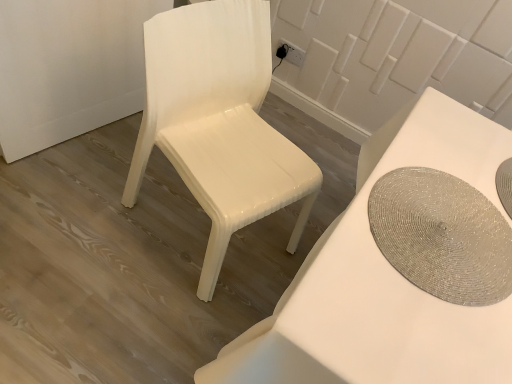
At what (x,y) coordinates should I click in order to perform the action: click on free spot above shiny silver placemat at right (from a real-world perspective). Please return your answer as a coordinate pair (x, y). The width and height of the screenshot is (512, 384). Looking at the image, I should click on (445, 232).